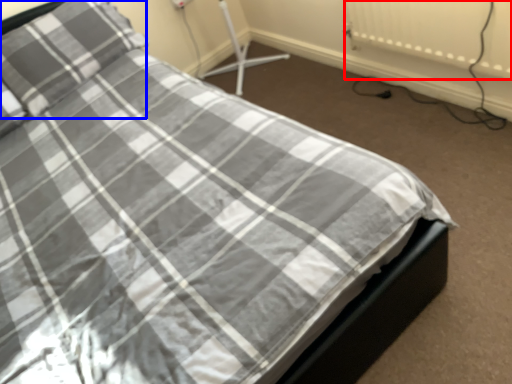
Question: Among these objects, which one is farthest to the camera, radiator (highlighted by a red box) or pillow (highlighted by a blue box)?

Choices:
 (A) radiator
 (B) pillow

Answer: (B)